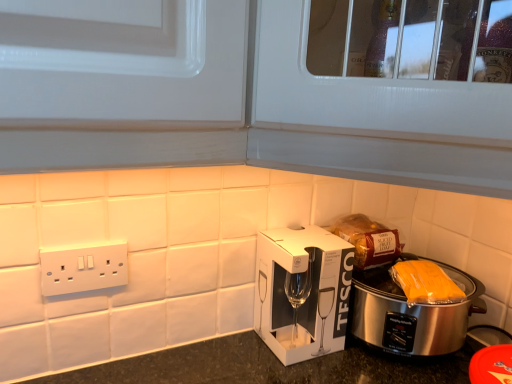
Question: From the image's perspective, relative to white textured cabinet at upper center, is yellow plastic bag at right above or below?

Choices:
 (A) above
 (B) below

Answer: (B)

Question: Based on their sizes in the image, would you say yellow plastic bag at right is bigger or smaller than white textured cabinet at upper center?

Choices:
 (A) big
 (B) small

Answer: (B)

Question: Based on their relative distances, which object is farther from the white cardboard box at center?

Choices:
 (A) silver metallic slow cooker at lower right
 (B) white textured cabinet at upper center
 (C) white plastic power plugs and sockets at lower left
 (D) yellow plastic bag at right

Answer: (B)

Question: Considering the real-world distances, which object is farthest from the white cardboard box at center?

Choices:
 (A) silver metallic slow cooker at lower right
 (B) white plastic power plugs and sockets at lower left
 (C) yellow plastic bag at right
 (D) white textured cabinet at upper center

Answer: (D)